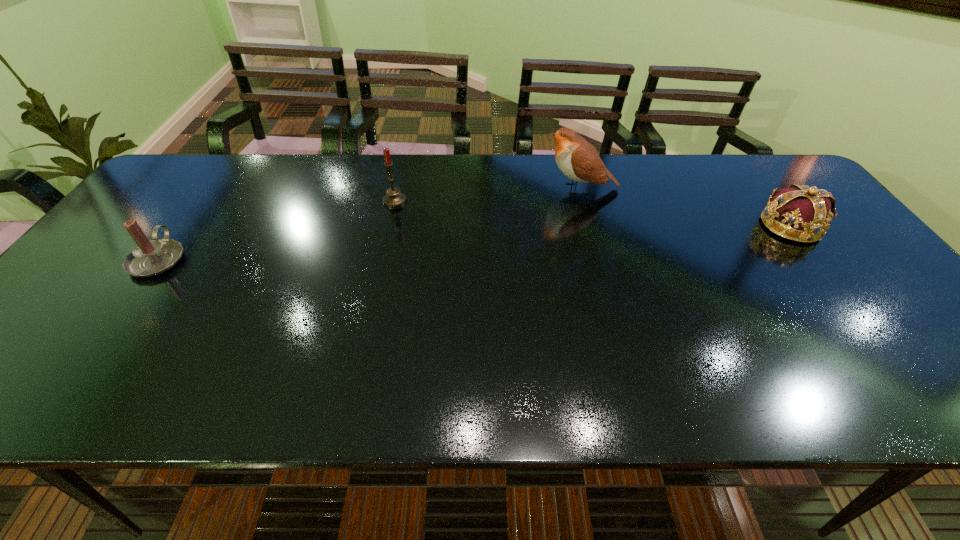
The height and width of the screenshot is (540, 960). What are the coordinates of `free spot located on the side of the nearer candle with the handle loop` in the screenshot? It's located at (185, 223).

Image resolution: width=960 pixels, height=540 pixels. I want to click on blank space located on the side of the nearer candle with the handle loop, so click(190, 217).

This screenshot has height=540, width=960. In order to click on free space located 0.340m on the side of the nearer candle with the handle loop in this screenshot , I will do `click(225, 169)`.

Where is `free location located 0.330m on the left of the rightmost object`? The width and height of the screenshot is (960, 540). free location located 0.330m on the left of the rightmost object is located at coordinates (637, 226).

The height and width of the screenshot is (540, 960). What are the coordinates of `bird present at the far edge` in the screenshot? It's located at (577, 159).

I want to click on candle present at the far edge, so click(394, 198).

Where is `object at the left edge`? This screenshot has height=540, width=960. object at the left edge is located at coordinates (150, 257).

Where is `object at the right edge`? The width and height of the screenshot is (960, 540). object at the right edge is located at coordinates (802, 213).

You are a GUI agent. You are given a task and a screenshot of the screen. Output one action in this format:
    pyautogui.click(x=<x>, y=<y>)
    Task: Click on the vacant position at the far edge of the desktop
    
    Given the screenshot: What is the action you would take?
    pyautogui.click(x=289, y=179)

This screenshot has height=540, width=960. Identify the location of vacant space at the near edge of the desktop. (655, 405).